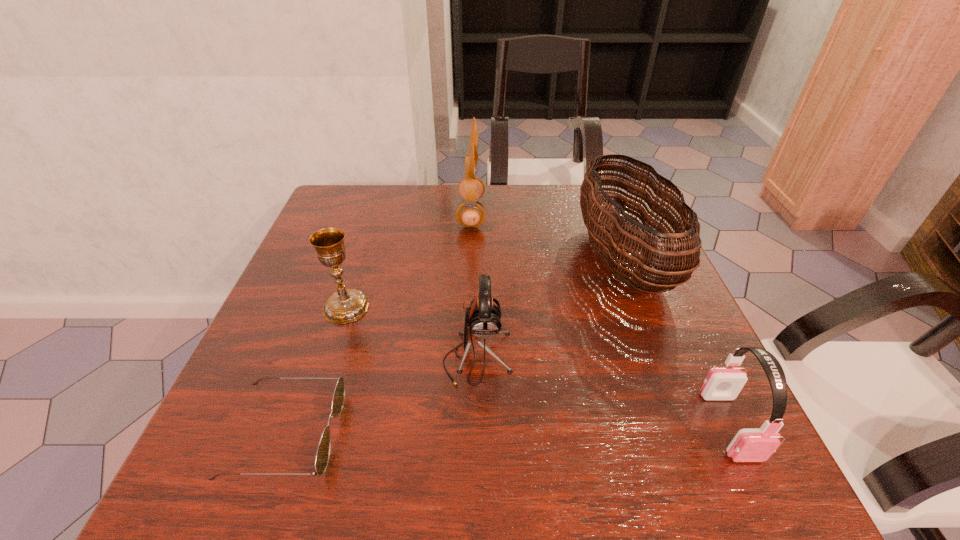
At what (x,y) coordinates should I click in order to perform the action: click on vacant area situated on the right of the second nearest earphone. Please return your answer as a coordinate pair (x, y). This screenshot has width=960, height=540. Looking at the image, I should click on (641, 358).

Image resolution: width=960 pixels, height=540 pixels. Identify the location of vacant space located on the outer surface of the rightmost earphone. (763, 497).

Identify the location of free spot located 0.300m on the front-facing side of the sunglasses. (524, 434).

Locate an element on the screen. The width and height of the screenshot is (960, 540). earphone that is at the far edge is located at coordinates (469, 214).

You are a GUI agent. You are given a task and a screenshot of the screen. Output one action in this format:
    pyautogui.click(x=<x>, y=<y>)
    Task: Click on the basket that is at the far edge
    This screenshot has width=960, height=540.
    Given the screenshot: What is the action you would take?
    pyautogui.click(x=632, y=259)

Identify the location of earphone located at the near edge. Image resolution: width=960 pixels, height=540 pixels. pyautogui.click(x=749, y=445).

Image resolution: width=960 pixels, height=540 pixels. I want to click on sunglasses located at the near edge, so click(322, 457).

Locate an element on the screen. chalice positioned at the left edge is located at coordinates (346, 305).

At what (x,y) coordinates should I click in order to perform the action: click on sunglasses present at the left edge. Please return your answer as a coordinate pair (x, y). This screenshot has height=540, width=960. Looking at the image, I should click on (322, 457).

This screenshot has width=960, height=540. I want to click on basket present at the right edge, so click(632, 259).